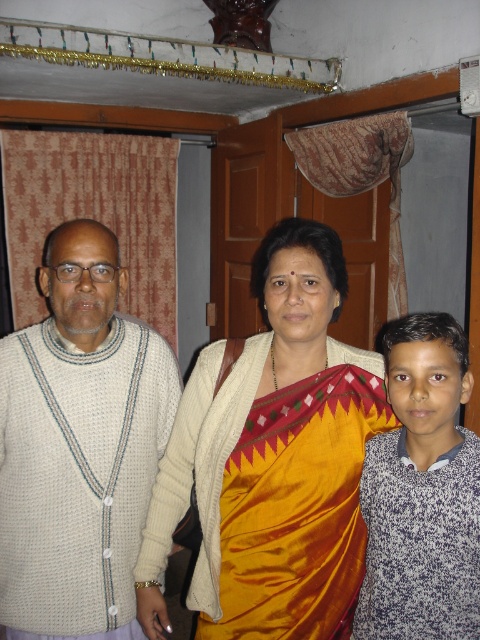
Does point (327, 515) come farther from viewer compared to point (129, 387)?

No, it is not.

Who is positioned more to the right, silk sari at center or white knitted sweater at left?

From the viewer's perspective, silk sari at center appears more on the right side.

Who is more distant from viewer, (277,256) or (86,636)?

The point (86,636) is more distant.

Locate an element on the screen. This screenshot has width=480, height=640. silk sari at center is located at coordinates (276, 456).

Between silk sari at center and white speckled sweater at right, which one appears on the left side from the viewer's perspective?

Positioned to the left is silk sari at center.

Is silk sari at center smaller than white speckled sweater at right?

Incorrect, silk sari at center is not smaller in size than white speckled sweater at right.

In order to click on silk sari at center in this screenshot , I will do `click(276, 456)`.

Does white knitted sweater at left have a lesser width compared to white speckled sweater at right?

No, white knitted sweater at left is not thinner than white speckled sweater at right.

The width and height of the screenshot is (480, 640). Describe the element at coordinates (79, 445) in the screenshot. I see `white knitted sweater at left` at that location.

Is point (115, 323) farther from viewer compared to point (405, 410)?

Yes, it is.

In order to click on white knitted sweater at left in this screenshot , I will do `click(79, 445)`.